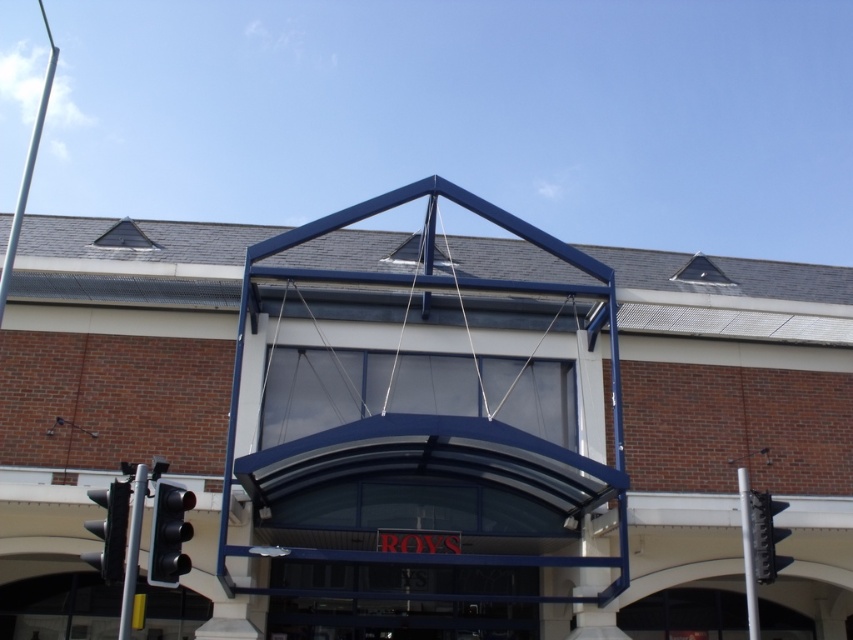
Question: Which object appears closest to the camera in this image?

Choices:
 (A) silver metallic pole at right
 (B) metallic traffic light pole at lower left
 (C) black plastic traffic light at left

Answer: (B)

Question: Does black plastic traffic light at left appear on the left side of silver metallic pole at right?

Choices:
 (A) no
 (B) yes

Answer: (B)

Question: Which object is the farthest from the metallic traffic light pole at lower left?

Choices:
 (A) silver metallic pole at right
 (B) black matte traffic light at lower left

Answer: (A)

Question: Is metallic traffic light pole at lower left thinner than silver metallic pole at right?

Choices:
 (A) yes
 (B) no

Answer: (B)

Question: Which point is closer to the camera?

Choices:
 (A) black glass traffic light at right
 (B) silver metallic pole at right
 (C) metallic traffic light pole at lower left

Answer: (C)

Question: Does black matte traffic light at lower left have a smaller size compared to black glass traffic light at right?

Choices:
 (A) yes
 (B) no

Answer: (A)